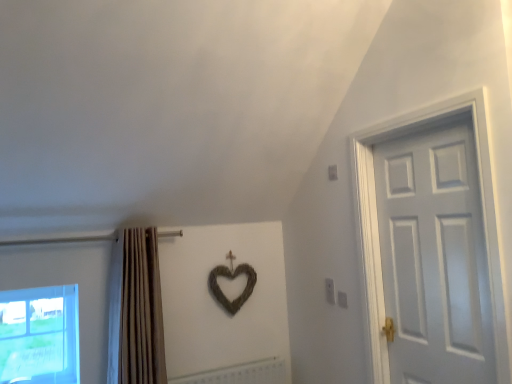
Question: Is beige fabric curtain at left located within white matte door at right?

Choices:
 (A) yes
 (B) no

Answer: (B)

Question: Is white matte door at right to the left of beige fabric curtain at left from the viewer's perspective?

Choices:
 (A) no
 (B) yes

Answer: (A)

Question: Can you confirm if white matte door at right is shorter than beige fabric curtain at left?

Choices:
 (A) no
 (B) yes

Answer: (A)

Question: Is white matte door at right outside beige fabric curtain at left?

Choices:
 (A) no
 (B) yes

Answer: (B)

Question: Is white matte door at right far away from beige fabric curtain at left?

Choices:
 (A) yes
 (B) no

Answer: (A)

Question: In terms of width, does beige fabric curtain at left look wider or thinner when compared to white matte door at right?

Choices:
 (A) wide
 (B) thin

Answer: (A)

Question: In the image, is beige fabric curtain at left positioned in front of or behind white matte door at right?

Choices:
 (A) front
 (B) behind

Answer: (B)

Question: Considering the positions of beige fabric curtain at left and white matte door at right in the image, is beige fabric curtain at left taller or shorter than white matte door at right?

Choices:
 (A) short
 (B) tall

Answer: (A)

Question: Do you think beige fabric curtain at left is within white matte door at right, or outside of it?

Choices:
 (A) inside
 (B) outside

Answer: (B)

Question: Does point (449, 235) appear closer or farther from the camera than point (129, 246)?

Choices:
 (A) closer
 (B) farther

Answer: (A)

Question: Considering the relative positions of white matte door at right and beige fabric curtain at left in the image provided, is white matte door at right to the left or to the right of beige fabric curtain at left?

Choices:
 (A) right
 (B) left

Answer: (A)

Question: Is white matte door at right in front of or behind beige fabric curtain at left in the image?

Choices:
 (A) front
 (B) behind

Answer: (A)

Question: In terms of size, does white matte door at right appear bigger or smaller than beige fabric curtain at left?

Choices:
 (A) small
 (B) big

Answer: (A)

Question: Visually, is transparent glass window at lower left positioned to the left or to the right of white matte radiator at center?

Choices:
 (A) right
 (B) left

Answer: (B)

Question: Considering the positions of transparent glass window at lower left and white matte radiator at center in the image, is transparent glass window at lower left wider or thinner than white matte radiator at center?

Choices:
 (A) thin
 (B) wide

Answer: (B)